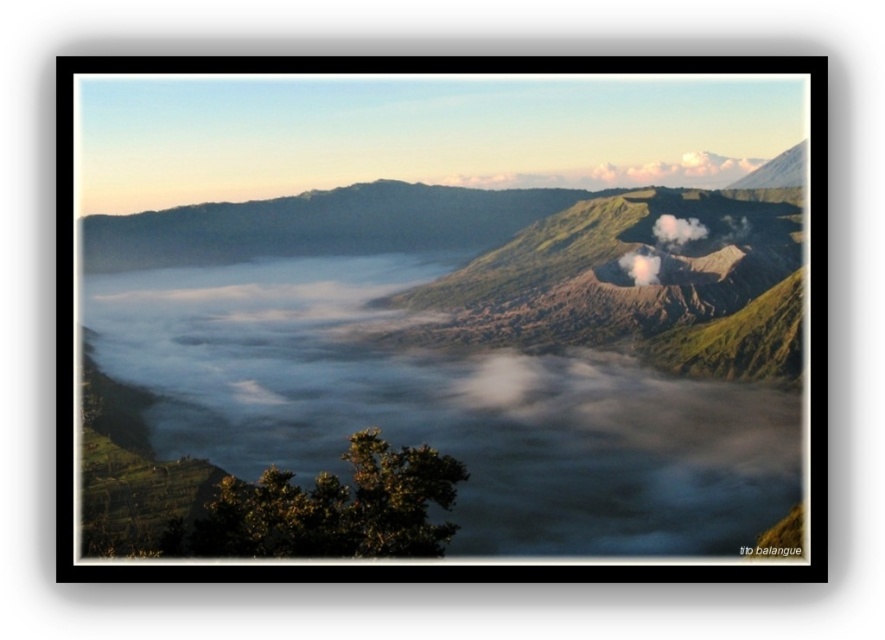
Question: Observing the image, what is the correct spatial positioning of white fluffy cloud at upper right in reference to white smoke at center?

Choices:
 (A) above
 (B) below

Answer: (A)

Question: Which object is farther from the camera taking this photo?

Choices:
 (A) white fluffy cloud at upper center
 (B) white smoke at center
 (C) white fluffy cloud at upper right
 (D) white smoke at upper right

Answer: (C)

Question: Can you confirm if white fluffy cloud at upper right is smaller than white smoke at upper right?

Choices:
 (A) no
 (B) yes

Answer: (A)

Question: Is white smoke at upper right above white smoke at center?

Choices:
 (A) yes
 (B) no

Answer: (A)

Question: Among these points, which one is farthest from the camera?

Choices:
 (A) (599, 179)
 (B) (675, 246)

Answer: (A)

Question: Estimate the real-world distances between objects in this image. Which object is farther from the white fluffy cloud at upper right?

Choices:
 (A) white smoke at upper right
 (B) white smoke at center

Answer: (B)